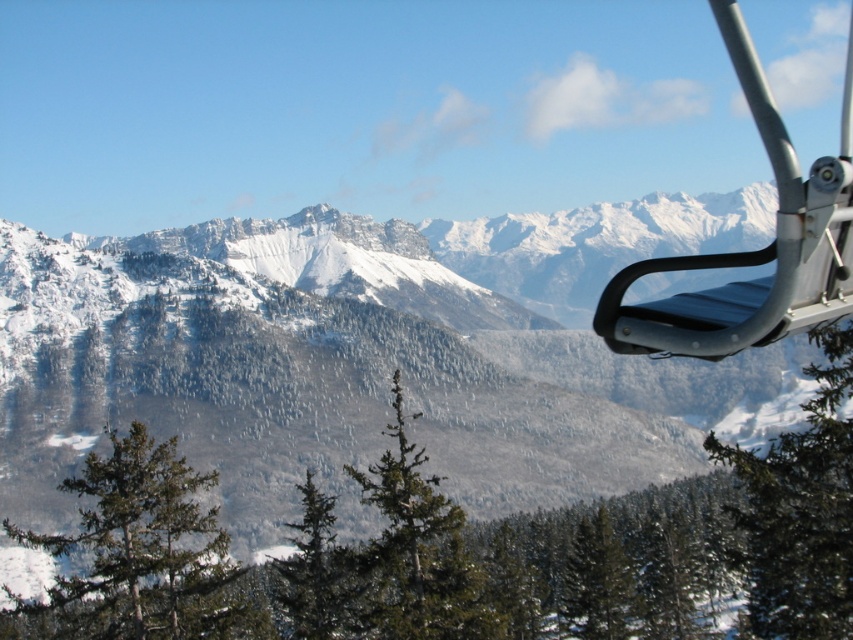
You are a photographer planning to capture a wide shot of the snowy mountain range at upper center and the metallic blue seat at upper right in a single frame. Your camera has a maximum focal length that allows capturing objects up to 150 meters apart in the same shot. Will you be able to include both objects in your photo?

The snowy mountain range at upper center and metallic blue seat at upper right are 154.63 meters apart. Since the distance exceeds the camera maximum focal length of 150 meters, you won not be able to capture both in the same frame.